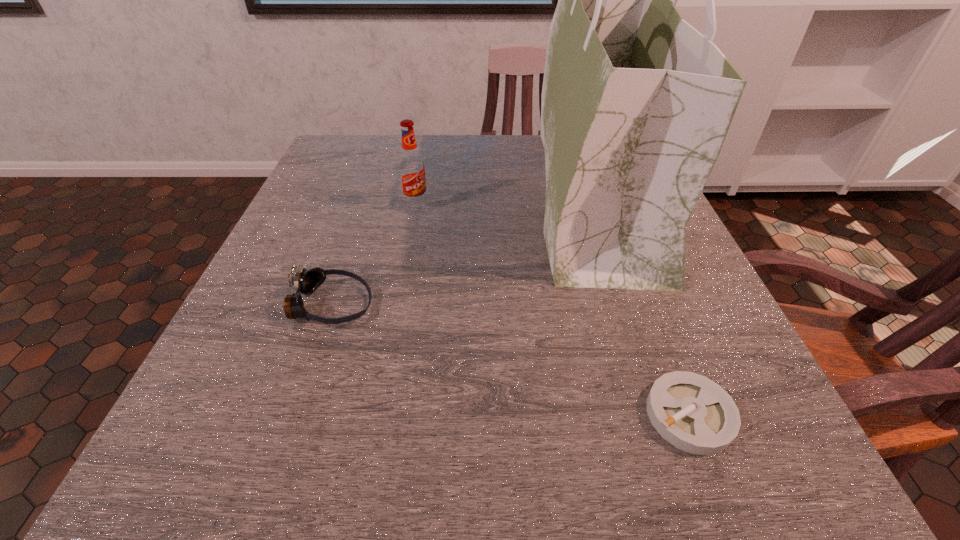
The width and height of the screenshot is (960, 540). In order to click on the tallest object in this screenshot , I will do [636, 103].

Find the location of a particular element. This screenshot has width=960, height=540. the second object from left to right is located at coordinates (411, 166).

Where is `the second tallest object`? The image size is (960, 540). the second tallest object is located at coordinates (411, 166).

Find the location of a particular element. Image resolution: width=960 pixels, height=540 pixels. goggles is located at coordinates (305, 282).

Locate an element on the screen. This screenshot has height=540, width=960. the second shortest object is located at coordinates (305, 282).

Identify the location of ashtray. (693, 413).

Identify the location of the nearest object. The height and width of the screenshot is (540, 960). (693, 413).

Locate an element on the screen. The image size is (960, 540). vacant space located on the left of the grocery bag is located at coordinates (514, 197).

Find the location of `vacant space located 0.330m on the right of the root beer`. vacant space located 0.330m on the right of the root beer is located at coordinates (579, 205).

Identify the location of free spot located 0.090m through the lenses of the leftmost object. Image resolution: width=960 pixels, height=540 pixels. (426, 305).